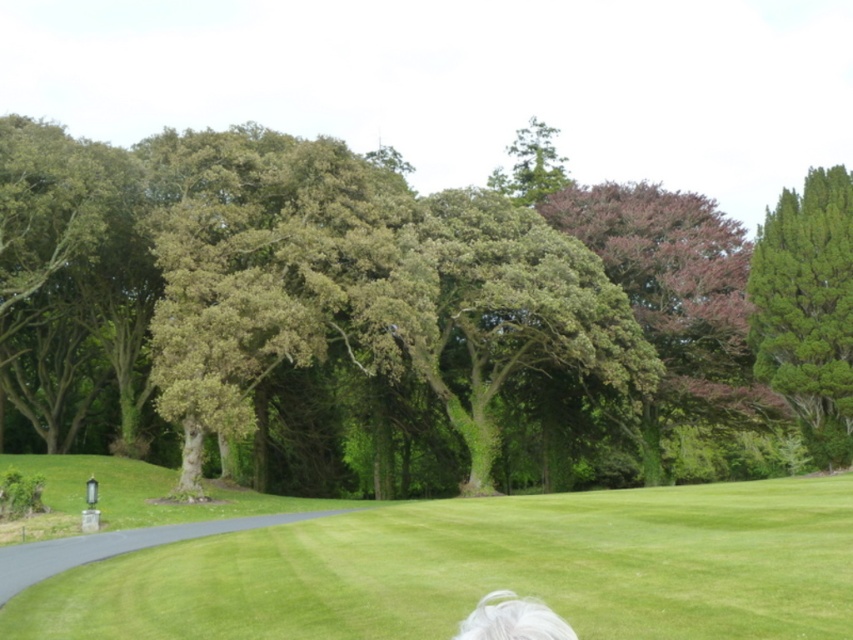
You are standing at the center of the grassy area and see the point marked at coordinates (x=410, y=316). What object is located at that point?

The point at coordinates 0.483 indicates the green leafy tree at center.

You are standing at the point marked by the coordinates point (410, 316) in the image. Which object are you directly facing?

You are directly facing the green leafy tree at center as indicated by the coordinates point (410, 316).